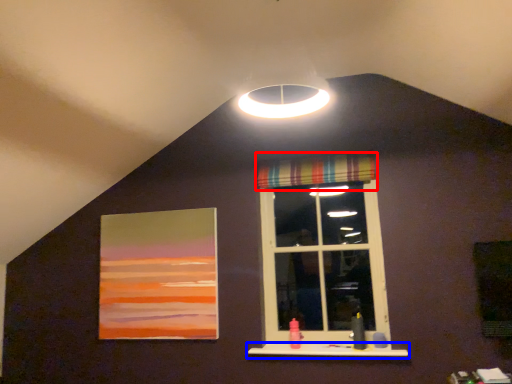
Question: Which object is further to the camera taking this photo, curtain (highlighted by a red box) or window sill (highlighted by a blue box)?

Choices:
 (A) curtain
 (B) window sill

Answer: (A)